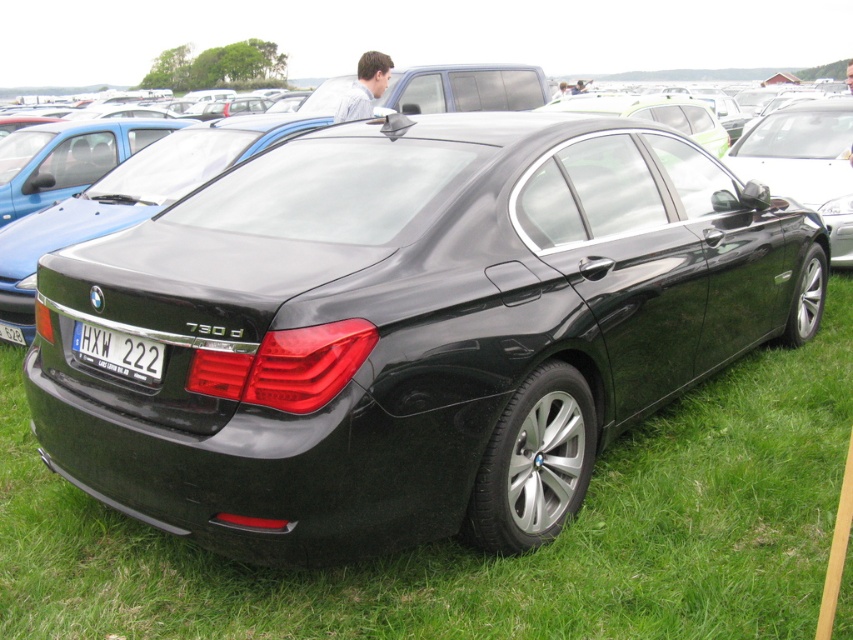
Question: Where is white plastic license plate at center located in relation to white plastic license plate at rear in the image?

Choices:
 (A) above
 (B) below

Answer: (B)

Question: Can you confirm if green grass at lower center is positioned to the left of white plastic license plate at rear?

Choices:
 (A) no
 (B) yes

Answer: (A)

Question: Among these points, which one is nearest to the camera?

Choices:
 (A) click(74, 340)
 (B) click(16, 340)
 (C) click(262, 577)

Answer: (C)

Question: Does green grass at lower center appear under white plastic license plate at rear?

Choices:
 (A) no
 (B) yes

Answer: (B)

Question: Which object is closer to the camera taking this photo?

Choices:
 (A) green grass at lower center
 (B) white plastic license plate at rear
 (C) white plastic license plate at center

Answer: (A)

Question: Estimate the real-world distances between objects in this image. Which object is farther from the white plastic license plate at center?

Choices:
 (A) green grass at lower center
 (B) white plastic license plate at rear

Answer: (B)